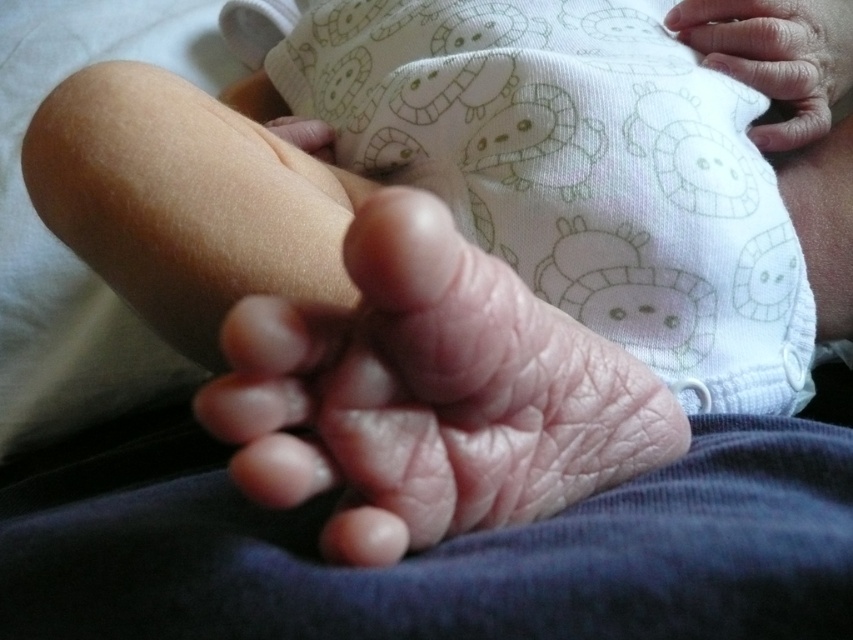
Does pink skin hand at center appear on the left side of smooth skin hand at upper right?

Yes, pink skin hand at center is to the left of smooth skin hand at upper right.

Identify the location of pink skin hand at center. (428, 394).

Does point (198, 419) come farther from viewer compared to point (821, 109)?

That is False.

I want to click on pink skin hand at center, so click(428, 394).